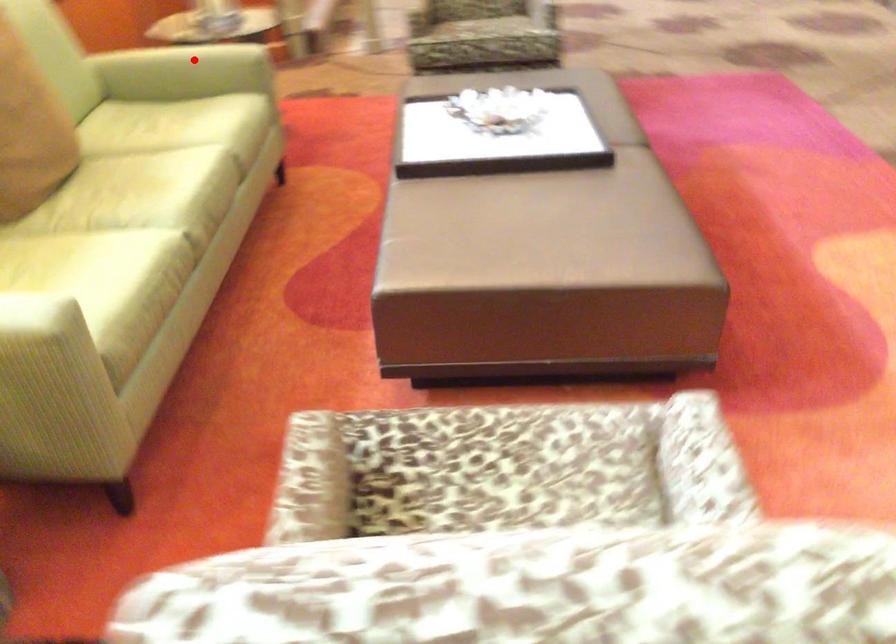
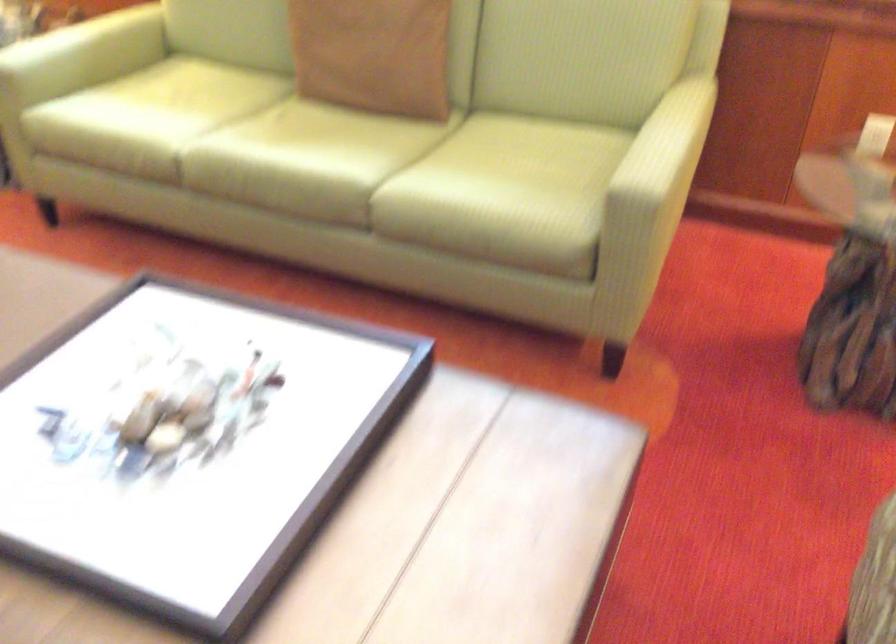
Question: I am providing you with two images of the same scene from different viewpoints. A red point is marked on the first image. Is the red point's position out of view in image 2?

Choices:
 (A) Yes
 (B) No

Answer: (A)